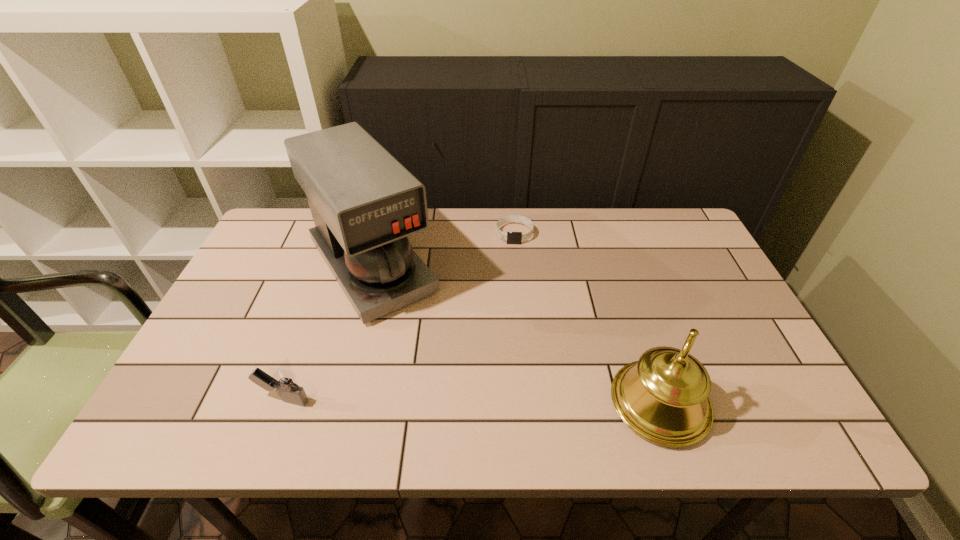
Locate an element on the screen. The image size is (960, 540). vacant area that lies between the bell and the igniter is located at coordinates (471, 402).

Locate an element on the screen. free space between the third tallest object and the coffee maker is located at coordinates (327, 334).

Find the location of a particular element. This screenshot has height=540, width=960. free spot between the wristband and the igniter is located at coordinates (398, 317).

Where is `free space between the wristband and the coffee maker`? This screenshot has height=540, width=960. free space between the wristband and the coffee maker is located at coordinates (444, 251).

Where is `free space between the third shortest object and the tallest object`? This screenshot has width=960, height=540. free space between the third shortest object and the tallest object is located at coordinates (516, 335).

You are a GUI agent. You are given a task and a screenshot of the screen. Output one action in this format:
    pyautogui.click(x=<x>, y=<y>)
    Task: Click on the free area in between the rightmost object and the coffee maker
    
    Given the screenshot: What is the action you would take?
    pyautogui.click(x=516, y=335)

What are the coordinates of `object that stands as the third closest to the wristband` in the screenshot? It's located at (283, 380).

The height and width of the screenshot is (540, 960). I want to click on object that is the closest to the second object from right to left, so click(x=364, y=203).

Locate an element on the screen. The image size is (960, 540). free location that satisfies the following two spatial constraints: 1. on the front side of the coffee maker; 2. on the left side of the rightmost object is located at coordinates (336, 403).

Locate an element on the screen. The height and width of the screenshot is (540, 960). free location that satisfies the following two spatial constraints: 1. on the back side of the coffee maker; 2. on the right side of the shortest object is located at coordinates (381, 234).